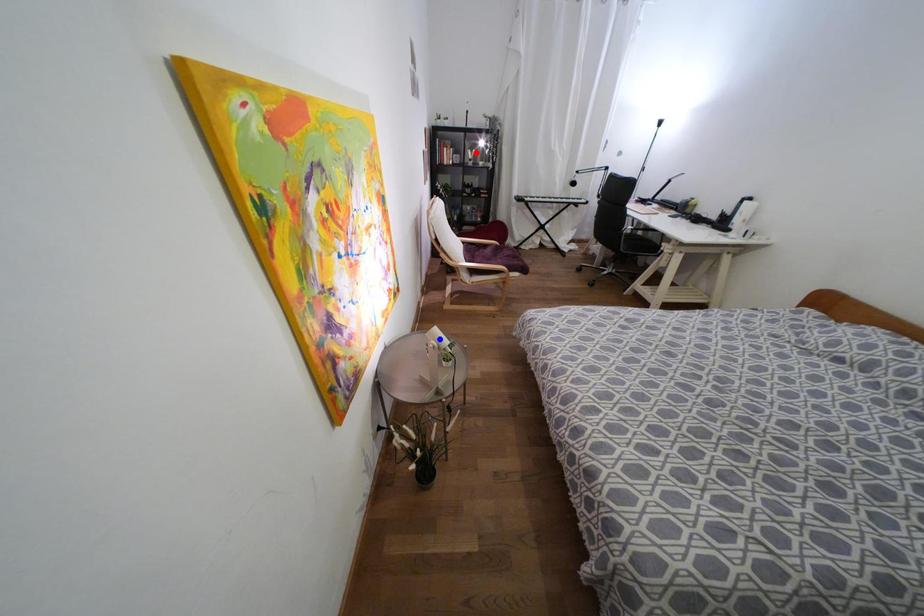
Question: Two points are marked on the image. Which point is closer to the camera?

Choices:
 (A) Blue point is closer.
 (B) Red point is closer.

Answer: (A)